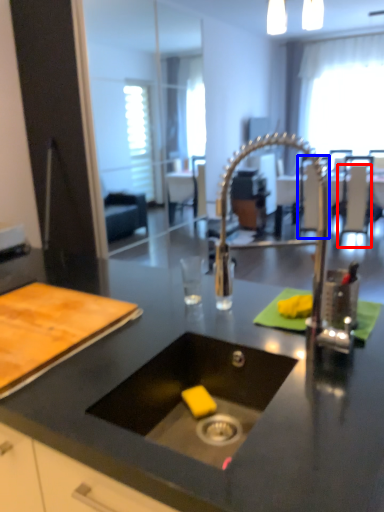
Question: Which of the following is the farthest to the observer, chair (highlighted by a red box) or chair (highlighted by a blue box)?

Choices:
 (A) chair
 (B) chair

Answer: (B)